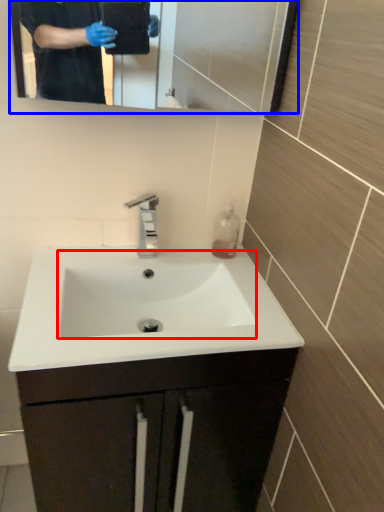
Question: Which object is closer to the camera taking this photo, sink (highlighted by a red box) or mirror (highlighted by a blue box)?

Choices:
 (A) sink
 (B) mirror

Answer: (B)